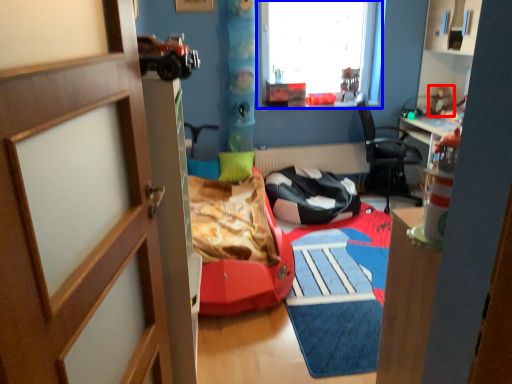
Question: Which object is closer to the camera taking this photo, toy (highlighted by a red box) or window (highlighted by a blue box)?

Choices:
 (A) toy
 (B) window

Answer: (B)